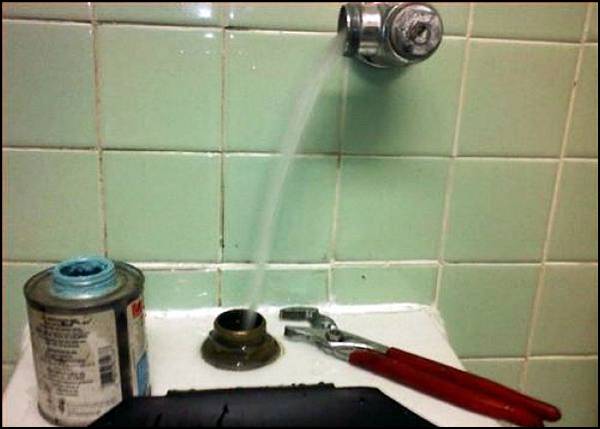
Identify the location of caulk. Image resolution: width=600 pixels, height=429 pixels. (384, 310), (178, 316).